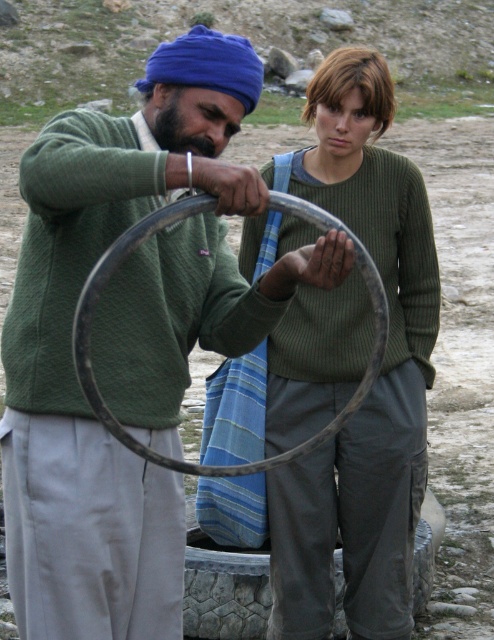
Question: Does green ribbed sweater at center appear over metallic silver hula hoop at center?

Choices:
 (A) yes
 (B) no

Answer: (B)

Question: Is green ribbed sweater at center closer to camera compared to metallic silver hula hoop at center?

Choices:
 (A) yes
 (B) no

Answer: (B)

Question: Which object is closer to the camera taking this photo?

Choices:
 (A) metallic silver hula hoop at center
 (B) green ribbed sweater at center

Answer: (A)

Question: Is green ribbed sweater at center thinner than metallic silver hula hoop at center?

Choices:
 (A) yes
 (B) no

Answer: (A)